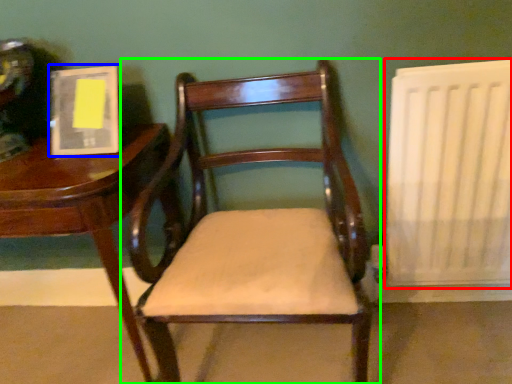
Question: Based on their relative distances, which object is nearer to radiator (highlighted by a red box)? Choose from book (highlighted by a blue box) and chair (highlighted by a green box).

Choices:
 (A) book
 (B) chair

Answer: (B)